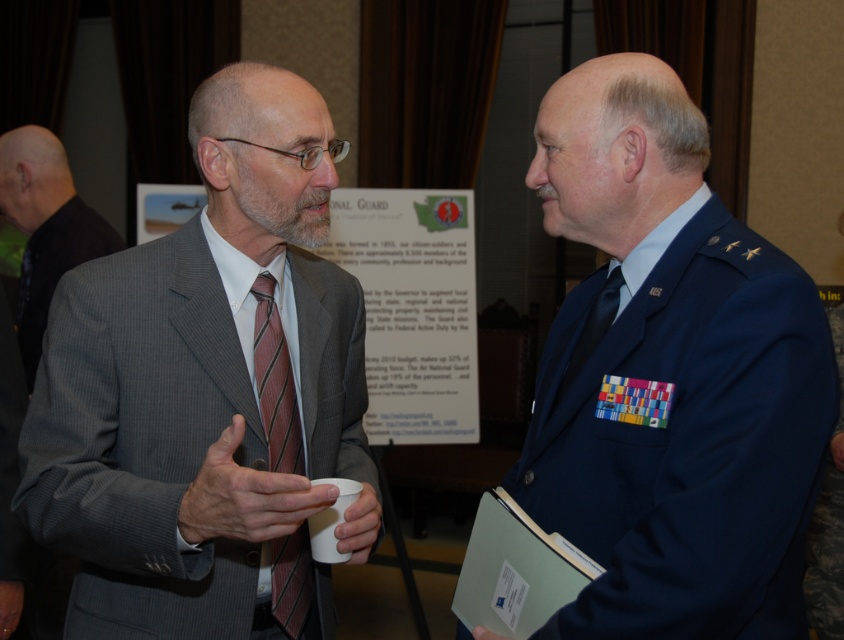
Question: Which of the following is the farthest from the observer?

Choices:
 (A) black silk tie at center
 (B) gray textured suit at left
 (C) striped silk tie at center

Answer: (B)

Question: Can you confirm if blue uniform at center is bigger than black silk tie at center?

Choices:
 (A) no
 (B) yes

Answer: (B)

Question: Is blue uniform at center smaller than gray textured suit at left?

Choices:
 (A) yes
 (B) no

Answer: (B)

Question: Which object appears closest to the camera in this image?

Choices:
 (A) striped silk tie at center
 (B) matte gray suit at center
 (C) blue uniform at center
 (D) black silk tie at center

Answer: (C)

Question: Which point is farther from the camera taking this photo?

Choices:
 (A) [x=271, y=467]
 (B) [x=599, y=326]
 (C) [x=190, y=636]
 (D) [x=558, y=221]

Answer: (A)

Question: Is blue uniform at center positioned before striped silk tie at center?

Choices:
 (A) yes
 (B) no

Answer: (A)